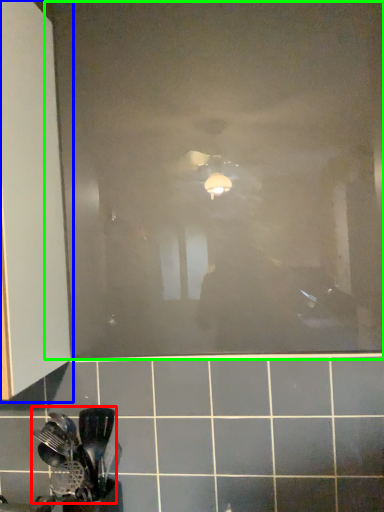
Question: Based on their relative distances, which object is farther from spatula (highlighted by a red box)? Choose from cabinetry (highlighted by a blue box) and glass door (highlighted by a green box).

Choices:
 (A) cabinetry
 (B) glass door

Answer: (B)